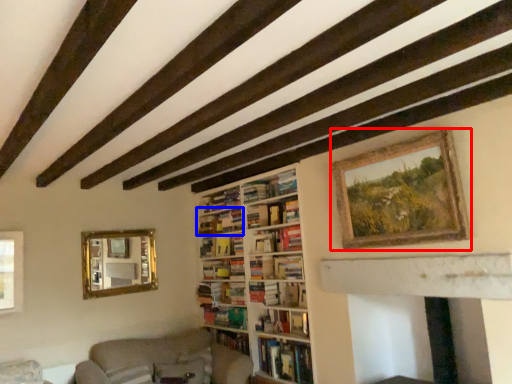
Question: Among these objects, which one is farthest to the camera, picture frame (highlighted by a red box) or book (highlighted by a blue box)?

Choices:
 (A) picture frame
 (B) book

Answer: (B)